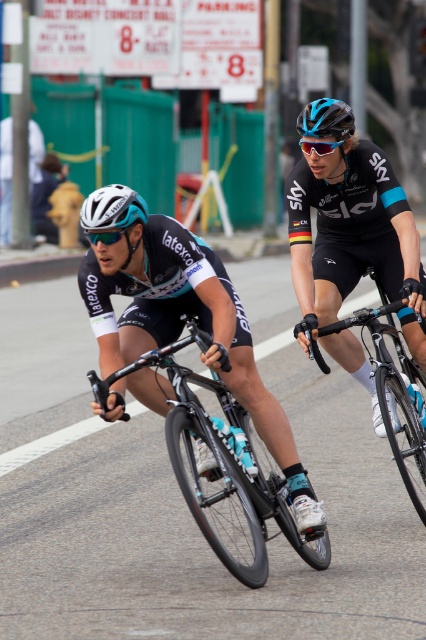
Between point (307, 256) and point (140, 365), which one is positioned in front?

Point (140, 365) is more forward.

Can you confirm if matte black bicycle at center is thinner than shiny black bicycle at center?

Yes, matte black bicycle at center is thinner than shiny black bicycle at center.

Is point (363, 364) positioned in front of point (158, 362)?

That is False.

The image size is (426, 640). What are the coordinates of `matte black bicycle at center` in the screenshot? It's located at pyautogui.click(x=350, y=220).

Can you confirm if shiny black frame at center is positioned to the right of white matte bicycle helmet at left?

Correct, you'll find shiny black frame at center to the right of white matte bicycle helmet at left.

Which is behind, point (383, 364) or point (86, 225)?

The point (383, 364) is more distant.

At what (x,y) coordinates should I click in order to perform the action: click on shiny black frame at center. Please return your answer as a coordinate pair (x, y). The width and height of the screenshot is (426, 640). Looking at the image, I should click on (394, 390).

Between shiny black bicycle at center and blue matte bicycle helmet at upper center, which one is positioned lower?

shiny black bicycle at center

Does shiny black bicycle at center have a lesser height compared to blue matte bicycle helmet at upper center?

Incorrect, shiny black bicycle at center's height does not fall short of blue matte bicycle helmet at upper center's.

Is point (181, 424) positioned after point (330, 122)?

That is False.

Identify the location of shiny black bicycle at center. (221, 467).